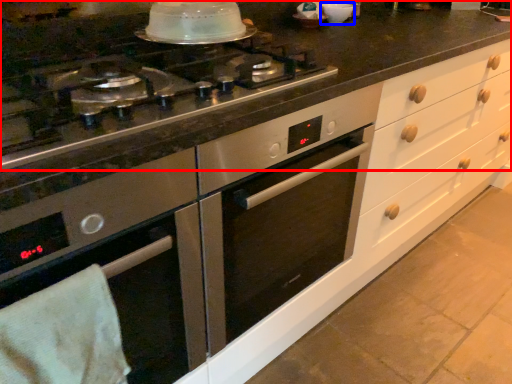
Question: Which point is closer to the camera, countertop (highlighted by a red box) or appliance (highlighted by a blue box)?

Choices:
 (A) countertop
 (B) appliance

Answer: (A)